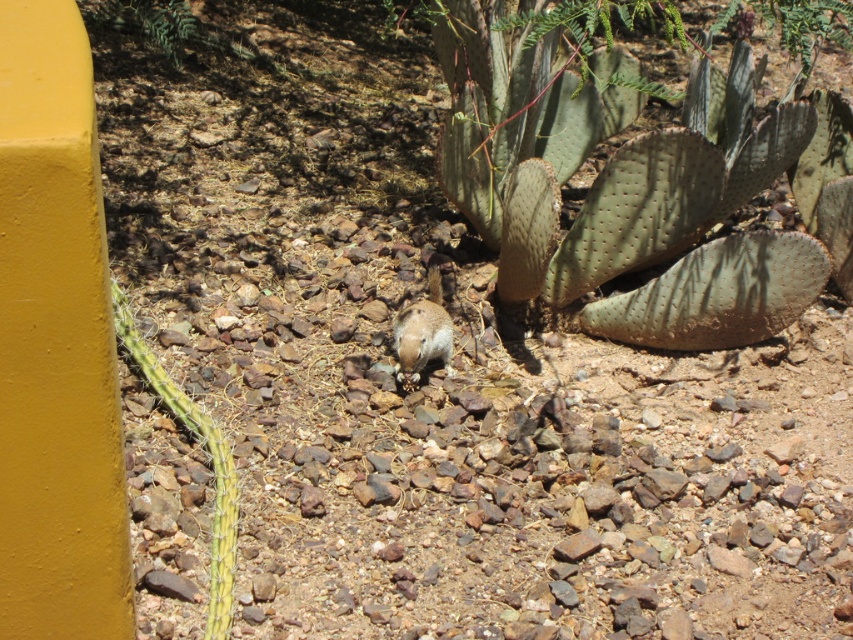
Question: Can you confirm if green spiny cactus at lower left is positioned above brown furry squirrel at center?

Choices:
 (A) no
 (B) yes

Answer: (A)

Question: In this image, where is green spiny cactus at lower left located relative to brown furry squirrel at center?

Choices:
 (A) above
 (B) below

Answer: (B)

Question: Can you confirm if green spiny cactus at center is thinner than green spiny cactus at lower left?

Choices:
 (A) no
 (B) yes

Answer: (A)

Question: Which point is farther from the camera taking this photo?

Choices:
 (A) (126, 326)
 (B) (691, 106)

Answer: (B)

Question: Among these objects, which one is farthest from the camera?

Choices:
 (A) green spiny cactus at center
 (B) green spiny cactus at lower left

Answer: (A)

Question: Which object appears farthest from the camera in this image?

Choices:
 (A) brown furry squirrel at center
 (B) green spiny cactus at lower left
 (C) green spiny cactus at center

Answer: (A)